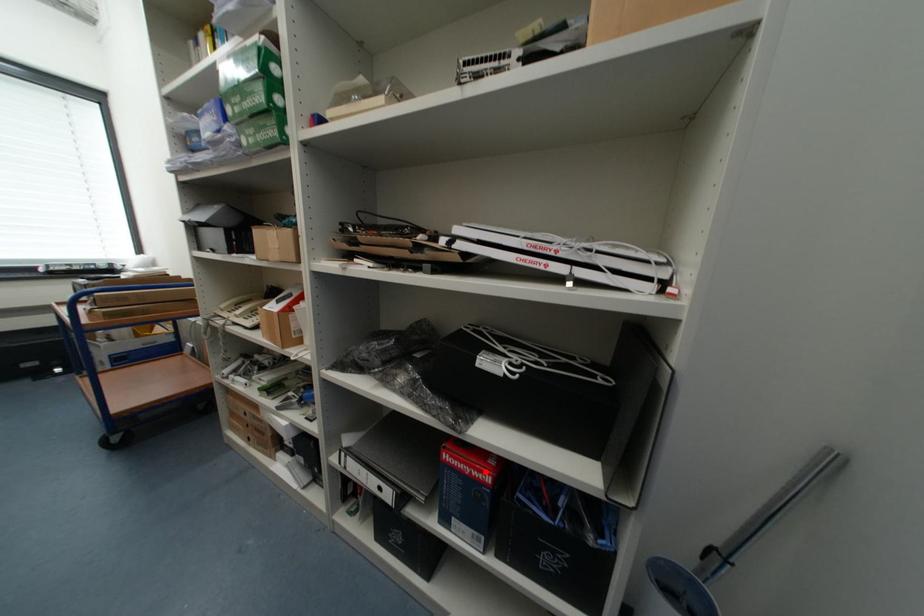
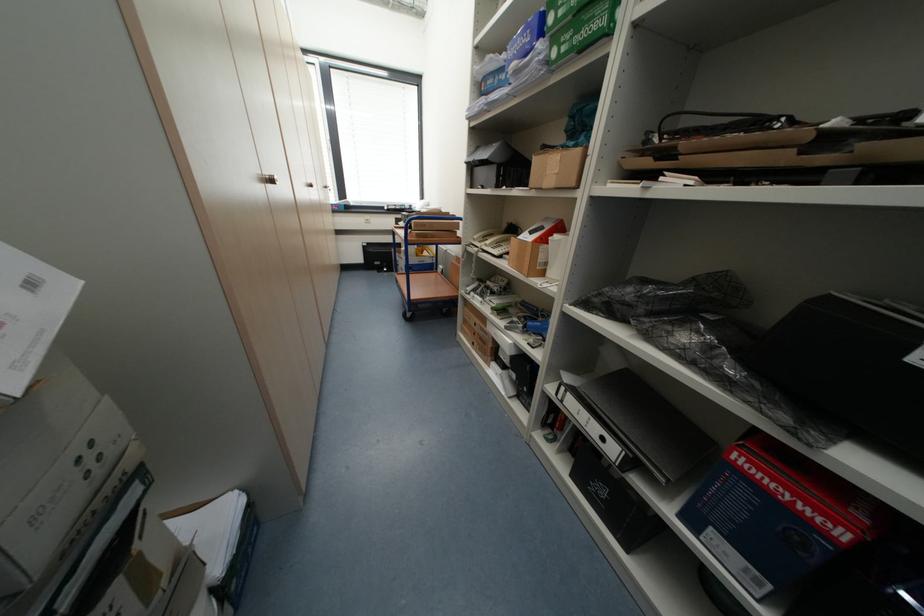
Find the pixel in the second image that matches the highlighted location in the first image.

(824, 513)